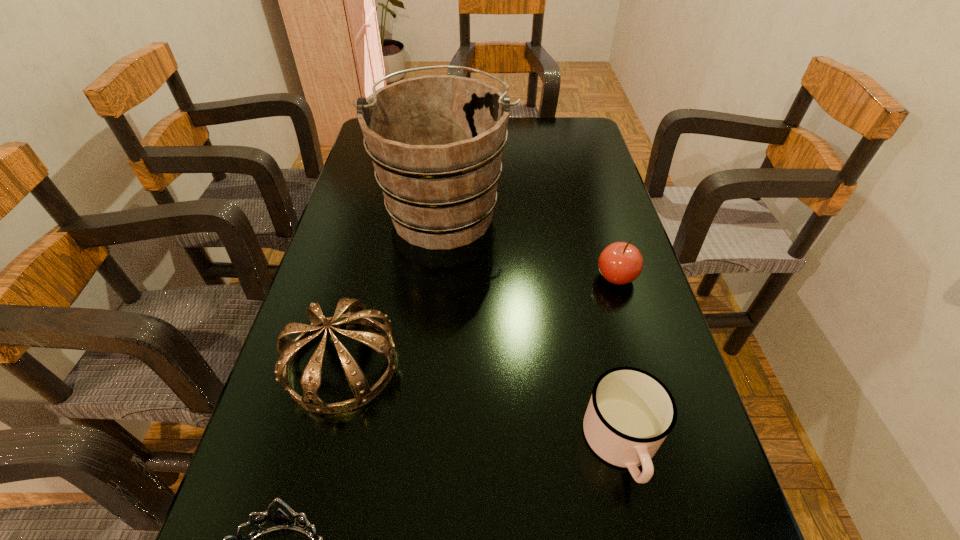
This screenshot has width=960, height=540. I want to click on empty space between the farthest object and the fourth nearest object, so click(x=531, y=244).

Identify the location of vacant space that's between the farthest object and the mug. tap(534, 328).

You are a GUI agent. You are given a task and a screenshot of the screen. Output one action in this format:
    pyautogui.click(x=<x>, y=<y>)
    Task: Click on the free spot between the apple and the mug
    
    Given the screenshot: What is the action you would take?
    pyautogui.click(x=619, y=360)

Where is `free area in between the taller tiara and the tallest object`? The image size is (960, 540). free area in between the taller tiara and the tallest object is located at coordinates (394, 288).

Where is `free space between the fourth shortest object and the farthest object`? This screenshot has height=540, width=960. free space between the fourth shortest object and the farthest object is located at coordinates (394, 288).

Select which object appears as the third closest to the second farthest object. Please provide its 2D coordinates. Your answer should be formatted as a tuple, i.e. [(x, y)], where the tuple contains the x and y coordinates of a point satisfying the conditions above.

[(358, 313)]

At what (x,y) coordinates should I click in order to perform the action: click on object that can be found as the closest to the mug. Please return your answer as a coordinate pair (x, y). The width and height of the screenshot is (960, 540). Looking at the image, I should click on (620, 263).